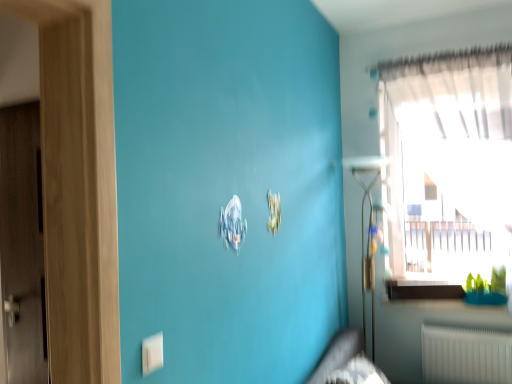
The width and height of the screenshot is (512, 384). Describe the element at coordinates (152, 353) in the screenshot. I see `white plastic electric outlet at lower left` at that location.

The image size is (512, 384). Identify the location of white glossy window sill at lower right. (422, 290).

The image size is (512, 384). What do you see at coordinates (345, 360) in the screenshot? I see `dark gray fabric bed frame at lower center` at bounding box center [345, 360].

What is the approximate width of dark gray fabric bed frame at lower center?

19.70 inches.

Identify the location of transparent glass window at upper right. (456, 160).

Can you confirm if white plastic electric outlet at lower left is taller than transparent glass window at upper right?

Incorrect, the height of white plastic electric outlet at lower left is not larger of that of transparent glass window at upper right.

What's the angular difference between white plastic electric outlet at lower left and transparent glass window at upper right's facing directions?

89.4 degrees.

Is white plastic electric outlet at lower left aimed at transparent glass window at upper right?

No, white plastic electric outlet at lower left does not turn towards transparent glass window at upper right.

Measure the distance from white plastic electric outlet at lower left to transparent glass window at upper right.

white plastic electric outlet at lower left is 7.25 feet away from transparent glass window at upper right.

Do you think white glossy window sill at lower right is within transparent glass window at upper right, or outside of it?

white glossy window sill at lower right exists entirely within transparent glass window at upper right.

I want to click on window above the white glossy window sill at lower right (from a real-world perspective), so click(x=456, y=160).

Considering the points (409, 280) and (500, 60), which point is behind, point (409, 280) or point (500, 60)?

The point (409, 280) is farther.

Which object is wider, white glossy window sill at lower right or transparent glass window at upper right?

transparent glass window at upper right.

Which object is more forward, transparent glass window at upper right or white glossy window sill at lower right?

transparent glass window at upper right.

Consider the image. Who is bigger, transparent glass window at upper right or white glossy window sill at lower right?

With larger size is transparent glass window at upper right.

Is transparent glass window at upper right positioned beyond the bounds of white glossy window sill at lower right?

Indeed, transparent glass window at upper right is completely outside white glossy window sill at lower right.

Can you tell me how much transparent glass window at upper right and white glossy window sill at lower right differ in facing direction?

They differ by 22 degrees in their facing directions.

Considering the relative sizes of dark gray fabric bed frame at lower center and transparent glass window at upper right in the image provided, is dark gray fabric bed frame at lower center shorter than transparent glass window at upper right?

Indeed, dark gray fabric bed frame at lower center has a lesser height compared to transparent glass window at upper right.

Which is more to the left, dark gray fabric bed frame at lower center or transparent glass window at upper right?

From the viewer's perspective, dark gray fabric bed frame at lower center appears more on the left side.

Is dark gray fabric bed frame at lower center facing towards transparent glass window at upper right?

No, dark gray fabric bed frame at lower center is not aimed at transparent glass window at upper right.

From a real-world perspective, between dark gray fabric bed frame at lower center and transparent glass window at upper right, who is vertically lower?

dark gray fabric bed frame at lower center is physically lower.

Considering the relative positions of white glossy window sill at lower right and dark gray fabric bed frame at lower center in the image provided, is white glossy window sill at lower right in front of dark gray fabric bed frame at lower center?

No, it is not.

Is dark gray fabric bed frame at lower center completely or partially inside white glossy window sill at lower right?

No, dark gray fabric bed frame at lower center is not a part of white glossy window sill at lower right.

Is white glossy window sill at lower right facing away from dark gray fabric bed frame at lower center?

That's not correct — white glossy window sill at lower right is not looking away from dark gray fabric bed frame at lower center.

From the image's perspective, who appears lower, white glossy window sill at lower right or dark gray fabric bed frame at lower center?

From the image's view, dark gray fabric bed frame at lower center is below.

I want to click on bed frame behind the white plastic electric outlet at lower left, so click(345, 360).

Does white plastic electric outlet at lower left appear on the right side of dark gray fabric bed frame at lower center?

In fact, white plastic electric outlet at lower left is to the left of dark gray fabric bed frame at lower center.

From a real-world perspective, who is located higher, white plastic electric outlet at lower left or dark gray fabric bed frame at lower center?

From a 3D spatial view, white plastic electric outlet at lower left is above.

From the image's perspective, relative to dark gray fabric bed frame at lower center, is white plastic electric outlet at lower left above or below?

white plastic electric outlet at lower left is above dark gray fabric bed frame at lower center.

Considering the relative sizes of dark gray fabric bed frame at lower center and white glossy window sill at lower right in the image provided, is dark gray fabric bed frame at lower center shorter than white glossy window sill at lower right?

In fact, dark gray fabric bed frame at lower center may be taller than white glossy window sill at lower right.

Based on their sizes in the image, would you say dark gray fabric bed frame at lower center is bigger or smaller than white glossy window sill at lower right?

Considering their sizes, dark gray fabric bed frame at lower center takes up more space than white glossy window sill at lower right.

Do you think dark gray fabric bed frame at lower center is within white glossy window sill at lower right, or outside of it?

The correct answer is: outside.

Is dark gray fabric bed frame at lower center further to the viewer compared to white glossy window sill at lower right?

That is False.

Identify the location of electric outlet in front of the transparent glass window at upper right. (152, 353).

Identify the location of window sill behind the transparent glass window at upper right. (422, 290).

Looking at the image, which one is located further to transparent glass window at upper right, dark gray fabric bed frame at lower center or white glossy window sill at lower right?

Among the two, dark gray fabric bed frame at lower center is located further to transparent glass window at upper right.

Based on their spatial positions, is white glossy window sill at lower right or white plastic electric outlet at lower left further from dark gray fabric bed frame at lower center?

Among the two, white plastic electric outlet at lower left is located further to dark gray fabric bed frame at lower center.

When comparing their distances from dark gray fabric bed frame at lower center, does white plastic electric outlet at lower left or white glossy window sill at lower right seem further?

→ Based on the image, white plastic electric outlet at lower left appears to be further to dark gray fabric bed frame at lower center.

Considering their positions, is transparent glass window at upper right positioned further to white glossy window sill at lower right than white plastic electric outlet at lower left?

white plastic electric outlet at lower left is further to white glossy window sill at lower right.

Which object lies nearer to the anchor point white plastic electric outlet at lower left, dark gray fabric bed frame at lower center or transparent glass window at upper right?

dark gray fabric bed frame at lower center lies closer to white plastic electric outlet at lower left than the other object.

Based on their spatial positions, is transparent glass window at upper right or white glossy window sill at lower right further from dark gray fabric bed frame at lower center?

The object further to dark gray fabric bed frame at lower center is transparent glass window at upper right.

When comparing their distances from white plastic electric outlet at lower left, does white glossy window sill at lower right or transparent glass window at upper right seem further?

transparent glass window at upper right is further to white plastic electric outlet at lower left.

Looking at the image, which one is located further to dark gray fabric bed frame at lower center, white glossy window sill at lower right or transparent glass window at upper right?

transparent glass window at upper right lies further to dark gray fabric bed frame at lower center than the other object.

Find the location of a particular element. Image resolution: width=512 pixels, height=384 pixels. bed frame situated between white plastic electric outlet at lower left and transparent glass window at upper right from left to right is located at coordinates point(345,360).

Where is `window sill between transparent glass window at upper right and dark gray fabric bed frame at lower center in the vertical direction`? window sill between transparent glass window at upper right and dark gray fabric bed frame at lower center in the vertical direction is located at coordinates (422, 290).

I want to click on bed frame located between white plastic electric outlet at lower left and white glossy window sill at lower right in the depth direction, so click(345, 360).

Locate an element on the screen. Image resolution: width=512 pixels, height=384 pixels. window between white plastic electric outlet at lower left and white glossy window sill at lower right in the front-back direction is located at coordinates (456, 160).